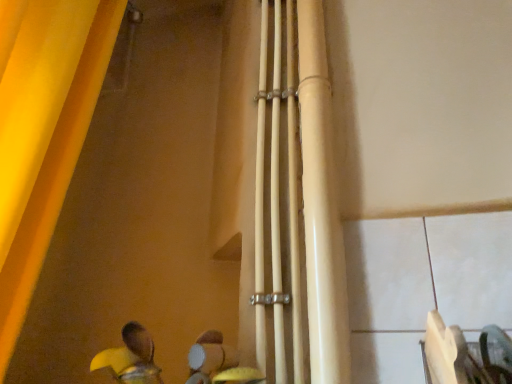
Question: Does matte white pipe at center have a smaller size compared to yellow fabric curtain at left?

Choices:
 (A) yes
 (B) no

Answer: (A)

Question: Is matte white pipe at center not near yellow fabric curtain at left?

Choices:
 (A) yes
 (B) no

Answer: (B)

Question: Could you tell me if matte white pipe at center is facing yellow fabric curtain at left?

Choices:
 (A) no
 (B) yes

Answer: (A)

Question: From the image's perspective, is matte white pipe at center beneath yellow fabric curtain at left?

Choices:
 (A) yes
 (B) no

Answer: (A)

Question: From a real-world perspective, is matte white pipe at center located higher than yellow fabric curtain at left?

Choices:
 (A) no
 (B) yes

Answer: (A)

Question: From a real-world perspective, does matte white pipe at center sit lower than yellow fabric curtain at left?

Choices:
 (A) yes
 (B) no

Answer: (A)

Question: From a real-world perspective, is yellow fabric curtain at left positioned over matte white pipe at center based on gravity?

Choices:
 (A) yes
 (B) no

Answer: (A)

Question: Does yellow fabric curtain at left appear on the right side of matte white pipe at center?

Choices:
 (A) no
 (B) yes

Answer: (A)

Question: Considering the relative positions of yellow fabric curtain at left and matte white pipe at center in the image provided, is yellow fabric curtain at left to the left of matte white pipe at center from the viewer's perspective?

Choices:
 (A) no
 (B) yes

Answer: (B)

Question: From the image's perspective, is yellow fabric curtain at left under matte white pipe at center?

Choices:
 (A) yes
 (B) no

Answer: (B)

Question: Could you tell me if yellow fabric curtain at left is facing matte white pipe at center?

Choices:
 (A) no
 (B) yes

Answer: (B)

Question: From a real-world perspective, is yellow fabric curtain at left under matte white pipe at center?

Choices:
 (A) yes
 (B) no

Answer: (B)

Question: From a real-world perspective, is yellow fabric curtain at left positioned above or below matte white pipe at center?

Choices:
 (A) below
 (B) above

Answer: (B)